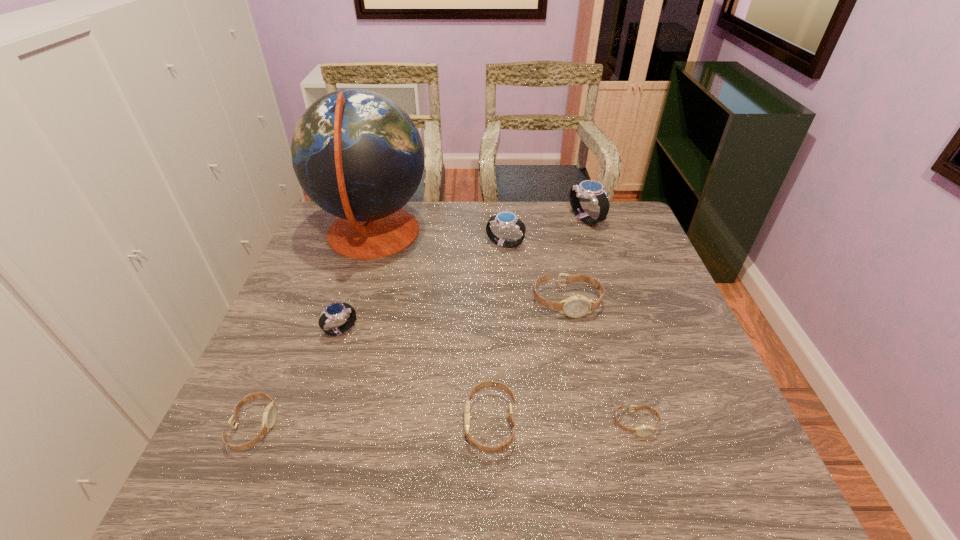
You are a GUI agent. You are given a task and a screenshot of the screen. Output one action in this format:
    pyautogui.click(x=<x>, y=<y>)
    Task: Click on the second beige watch from left to right
    This screenshot has width=960, height=540.
    Given the screenshot: What is the action you would take?
    point(506,444)

Identify the location of the second smallest beige watch. tap(270, 412).

Identify the location of the second shortest object. (270, 412).

Where is `the shortest object`? Image resolution: width=960 pixels, height=540 pixels. the shortest object is located at coordinates (645, 430).

At what (x,y) coordinates should I click in order to perform the action: click on the shortest watch. Please return your answer as a coordinate pair (x, y). This screenshot has height=540, width=960. Looking at the image, I should click on (645, 430).

What are the coordinates of `vacant space situated 0.370m with the Americas facing the viewer on the tallest object` in the screenshot? It's located at (545, 234).

At what (x,y) coordinates should I click in order to perform the action: click on vacant space located on the front of the biggest silver watch. Please return your answer as a coordinate pair (x, y). The image size is (960, 540). Looking at the image, I should click on (618, 320).

Where is `vacant area located 0.380m on the left of the sixth shortest object`? This screenshot has width=960, height=540. vacant area located 0.380m on the left of the sixth shortest object is located at coordinates (364, 245).

You are a GUI agent. You are given a task and a screenshot of the screen. Output one action in this format:
    pyautogui.click(x=<x>, y=<y>)
    Task: Click on the vacant space located 0.070m on the face of the fifth nearest watch
    Image resolution: width=960 pixels, height=540 pixels.
    Given the screenshot: What is the action you would take?
    pyautogui.click(x=575, y=340)

This screenshot has width=960, height=540. In order to click on vacant point located on the front of the fourth nearest watch in this screenshot , I will do `click(318, 402)`.